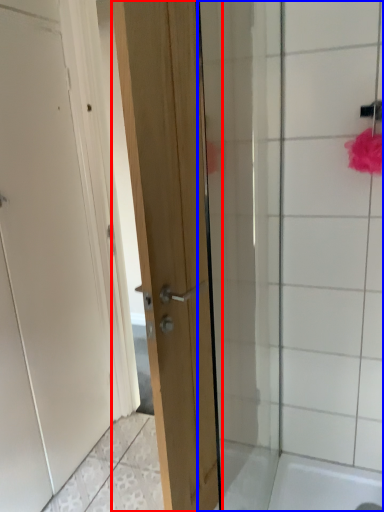
Question: Which object is closer to the camera taking this photo, door (highlighted by a red box) or shower door (highlighted by a blue box)?

Choices:
 (A) door
 (B) shower door

Answer: (A)